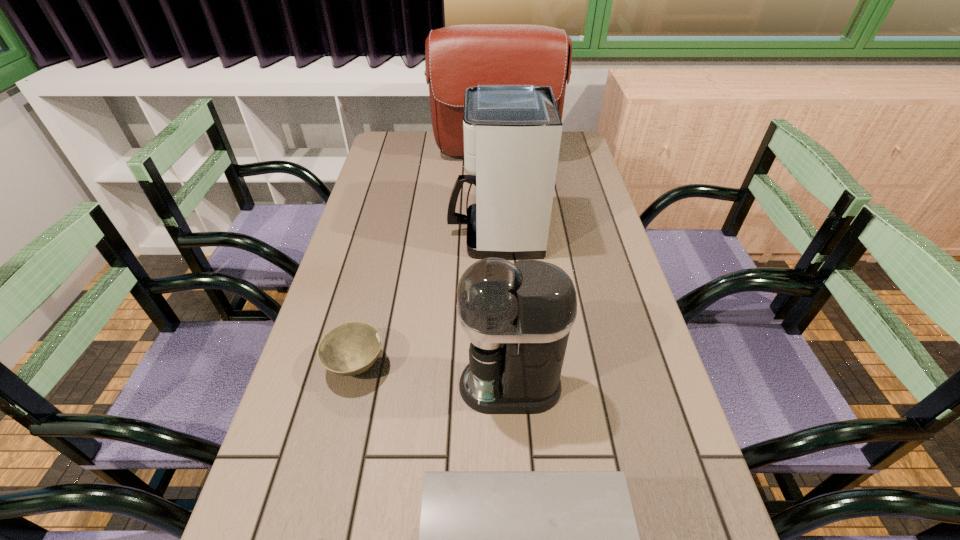
Identify the location of free space at the right edge of the desktop. The width and height of the screenshot is (960, 540). (589, 310).

Locate an element on the screen. free space at the far left corner of the desktop is located at coordinates (381, 159).

This screenshot has height=540, width=960. I want to click on vacant area at the far right corner, so click(582, 156).

The width and height of the screenshot is (960, 540). I want to click on object that is the second closest to the shortest object, so click(x=488, y=539).

Point out which object is positioned as the third nearest to the farthest object. Please provide its 2D coordinates. Your answer should be formatted as a tuple, i.e. [(x, y)], where the tuple contains the x and y coordinates of a point satisfying the conditions above.

[(518, 316)]

You are a GUI agent. You are given a task and a screenshot of the screen. Output one action in this format:
    pyautogui.click(x=<x>, y=<y>)
    Task: Click on the coffee maker that is the closest to the farthest coffee maker
    
    Given the screenshot: What is the action you would take?
    pyautogui.click(x=518, y=316)

Locate which coffee maker ranks second in proximity to the satchel. Please provide its 2D coordinates. Your answer should be formatted as a tuple, i.e. [(x, y)], where the tuple contains the x and y coordinates of a point satisfying the conditions above.

[(518, 316)]